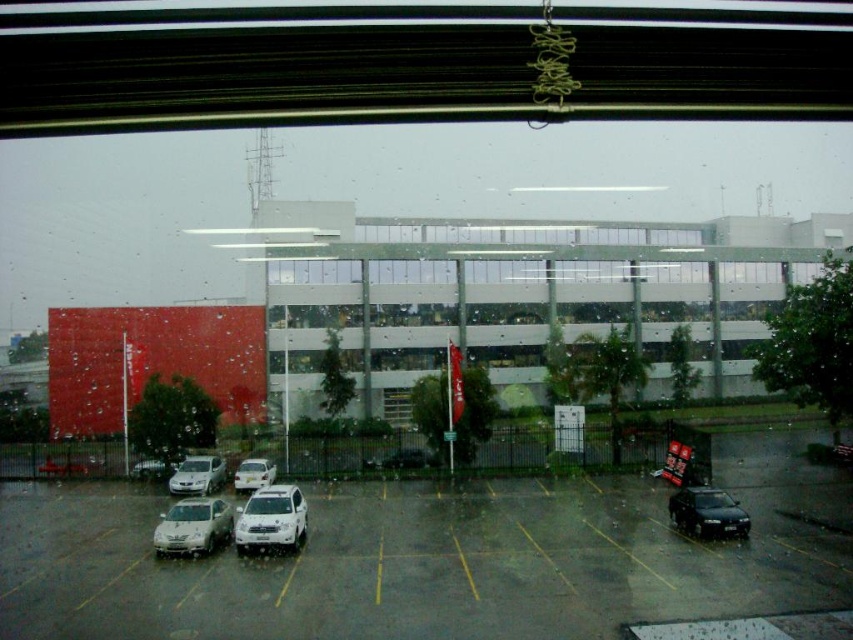
Question: Is gray asphalt parking lot at lower center thinner than satin black sedan at lower right?

Choices:
 (A) yes
 (B) no

Answer: (B)

Question: Estimate the real-world distances between objects in this image. Which object is farther from the satin silver sedan at lower center?

Choices:
 (A) white matte car at center
 (B) satin white suv at center
 (C) white glossy building at center

Answer: (C)

Question: Which of the following is the closest to the observer?

Choices:
 (A) (711, 518)
 (B) (146, 464)

Answer: (A)

Question: Can you confirm if gray asphalt parking lot at lower center is positioned below white glossy building at center?

Choices:
 (A) no
 (B) yes

Answer: (B)

Question: Is satin white suv at center smaller than satin silver suv at lower left?

Choices:
 (A) no
 (B) yes

Answer: (A)

Question: Which of the following is the closest to the observer?

Choices:
 (A) satin silver sedan at lower left
 (B) satin silver suv at lower left

Answer: (B)